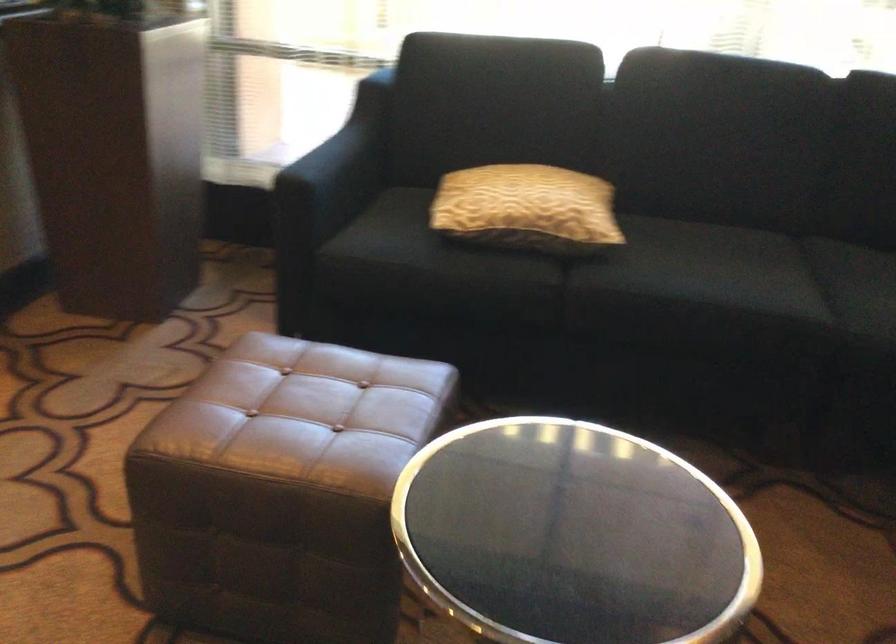
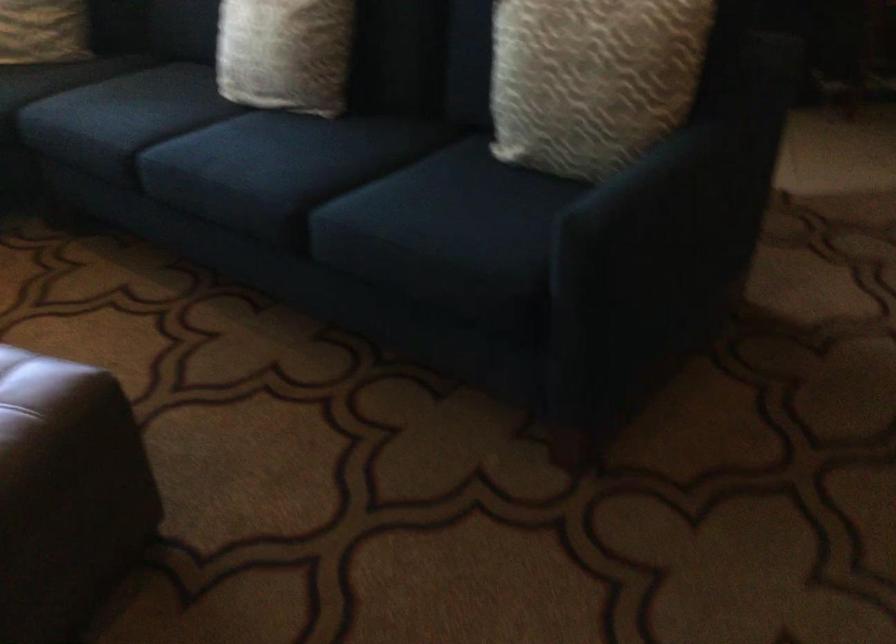
The first image is from the beginning of the video and the second image is from the end. How did the camera likely rotate when shooting the video?

The camera rotated toward right-down.